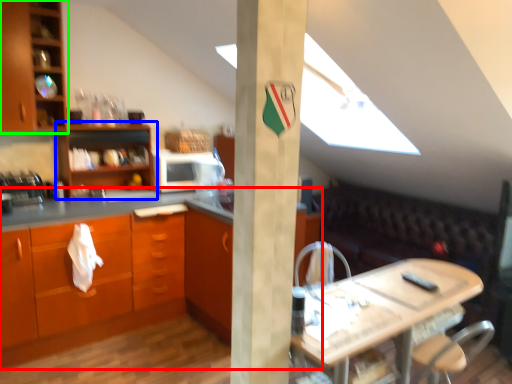
Question: Based on their relative distances, which object is nearer to countertop (highlighted by a red box)? Choose from shelf (highlighted by a blue box) and cabinetry (highlighted by a green box).

Choices:
 (A) shelf
 (B) cabinetry

Answer: (A)